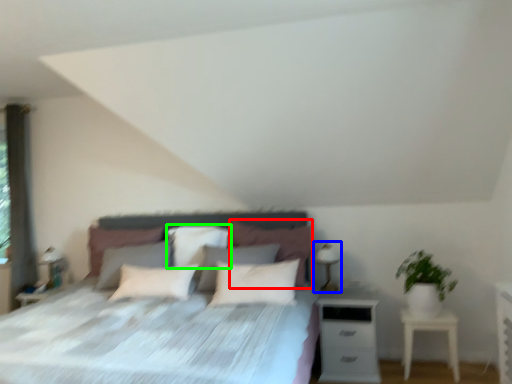
Question: Which object is positioned closest to pillow (highlighted by a red box)? Select from table lamp (highlighted by a blue box) and pillow (highlighted by a green box).

Choices:
 (A) table lamp
 (B) pillow

Answer: (A)